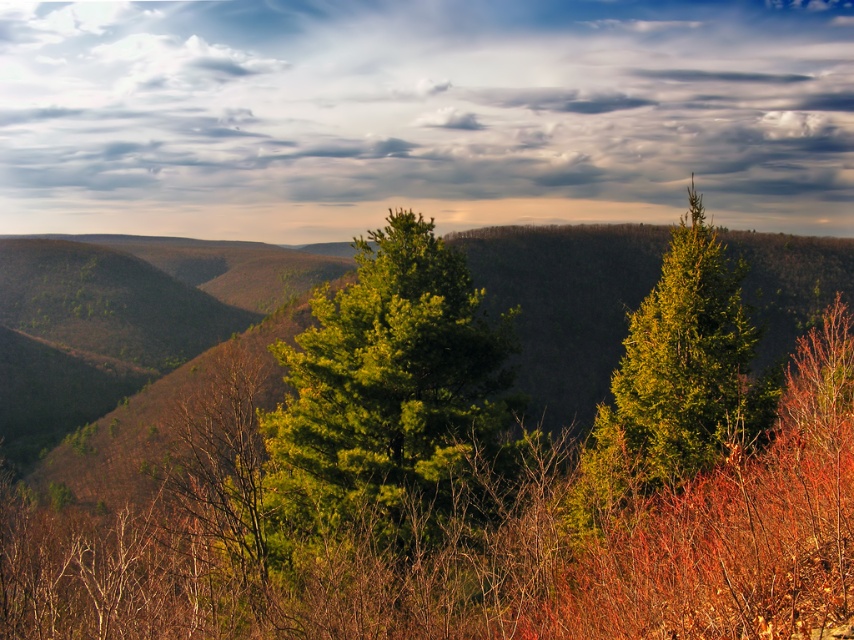
Based on the photo, can you confirm if cloudy sky at upper center is wider than green needle-like at center?

Yes, cloudy sky at upper center is wider than green needle-like at center.

Based on the photo, between cloudy sky at upper center and green needle-like at center, which one is positioned higher?

cloudy sky at upper center is above.

The image size is (854, 640). What are the coordinates of `cloudy sky at upper center` in the screenshot? It's located at (420, 115).

You are a GUI agent. You are given a task and a screenshot of the screen. Output one action in this format:
    pyautogui.click(x=<x>, y=<y>)
    Task: Click on the cloudy sky at upper center
    
    Given the screenshot: What is the action you would take?
    pyautogui.click(x=420, y=115)

Does point (466, 392) come farther from viewer compared to point (653, 298)?

That is True.

Based on the photo, is green needle-like at center shorter than green glossy tree at upper right?

No.

Identify the location of green needle-like at center. This screenshot has height=640, width=854. (389, 401).

Does cloudy sky at upper center appear on the right side of green glossy tree at upper right?

In fact, cloudy sky at upper center is to the left of green glossy tree at upper right.

Identify the location of cloudy sky at upper center. (420, 115).